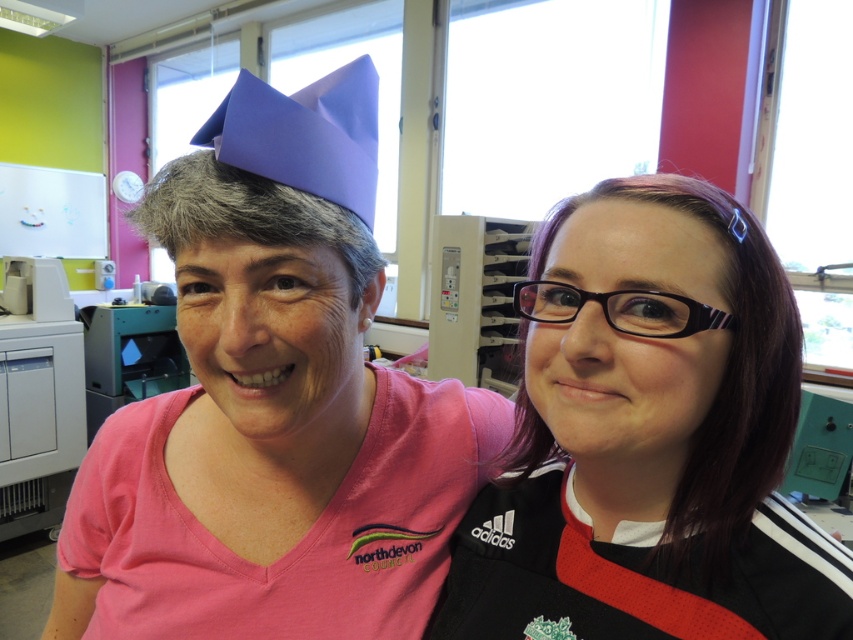
You are standing in an office and see a point at coordinates point (317, 312). If you want to reach it with a 16 inch long ruler, can you do it?

The point (317, 312) is 18.39 inches from the viewer, so the 16 inch ruler is too short to reach it.

You are an interior designer analyzing the office layout. You need to place a new desk lamp that will illuminate the area where the matte black glasses at upper right are located. Based on their current position, where should you position the lamp to best light that spot?

The matte black glasses at upper right is located at point [648,438], so the desk lamp should be positioned to shine light towards those coordinates to effectively illuminate the area where the matte black glasses at upper right are placed.

You are standing in an office and see two points marked in the image. Which point is closer to you, point (305, 579) or point (367, 92)?

Point (305, 579) is closer to you because it is further to the viewer than point (367, 92).